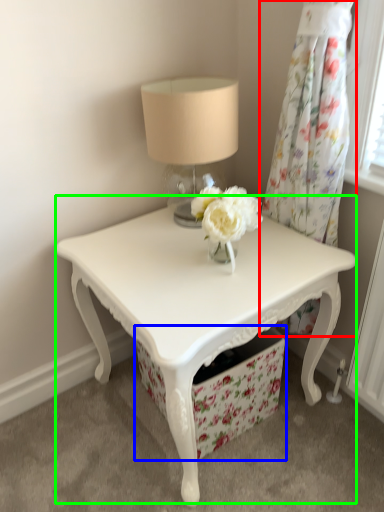
Question: Which object is positioned farthest from curtain (highlighted by a red box)? Select from drawer (highlighted by a blue box) and table (highlighted by a green box).

Choices:
 (A) drawer
 (B) table

Answer: (A)